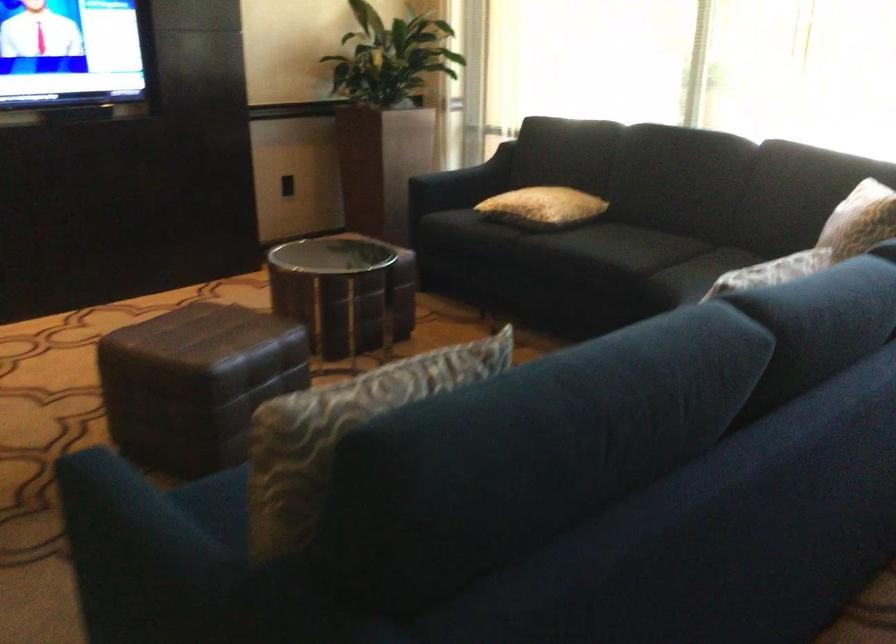
Describe the element at coordinates (288, 185) in the screenshot. I see `the black wall switch` at that location.